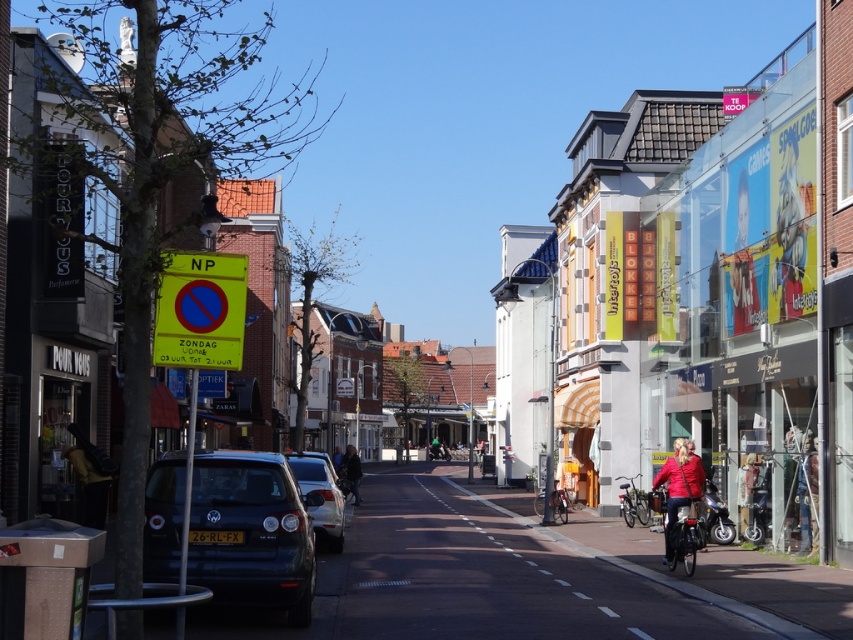
You are standing at the center of the street in the European town scene. There are two points marked on the ground, one at point coordinates (146, 481) and another at point coordinates (692, 506). Which point is closer to you?

Point (146, 481) is in front of point (692, 506), so it is closer to you.